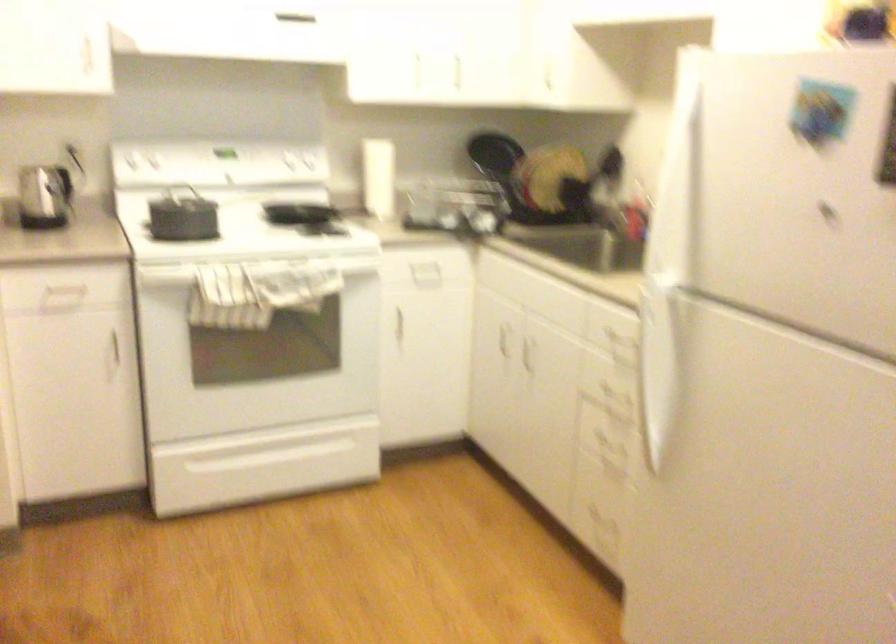
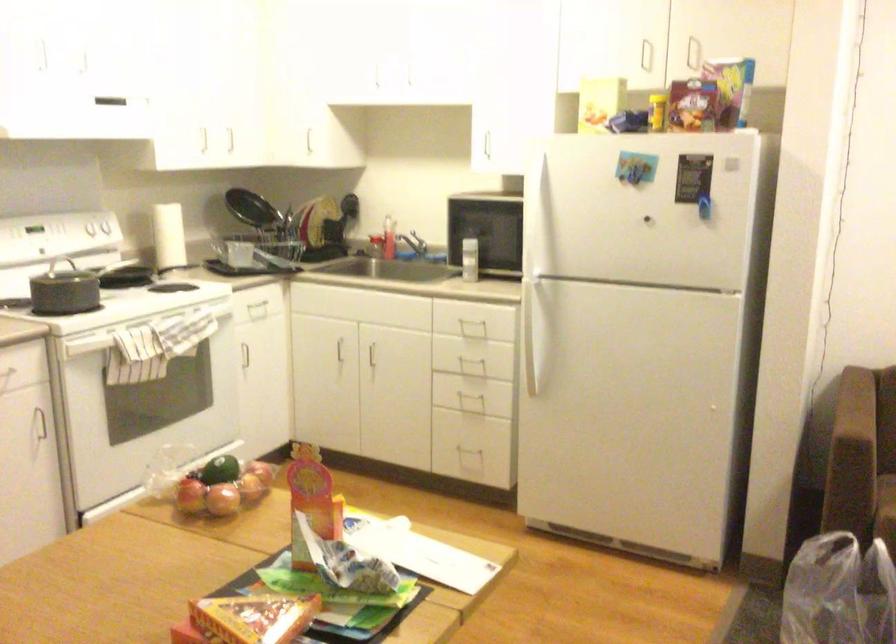
Question: I am providing you with two images of the same scene from different viewpoints. Please identify which objects are invisible in image2.

Choices:
 (A) green avocado
 (B) oven door handle
 (C) dark blue suitcase
 (D) oven drawer handle

Answer: (D)